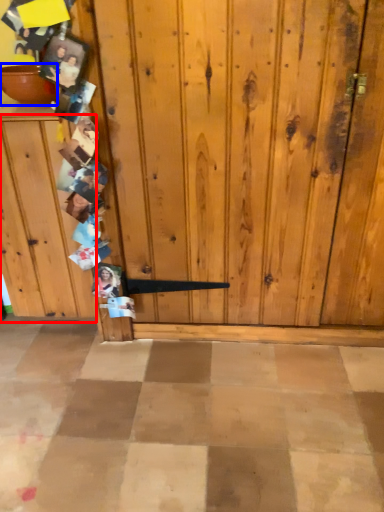
Question: Which object is closer to the camera taking this photo, dresser (highlighted by a red box) or bowl (highlighted by a blue box)?

Choices:
 (A) dresser
 (B) bowl

Answer: (A)